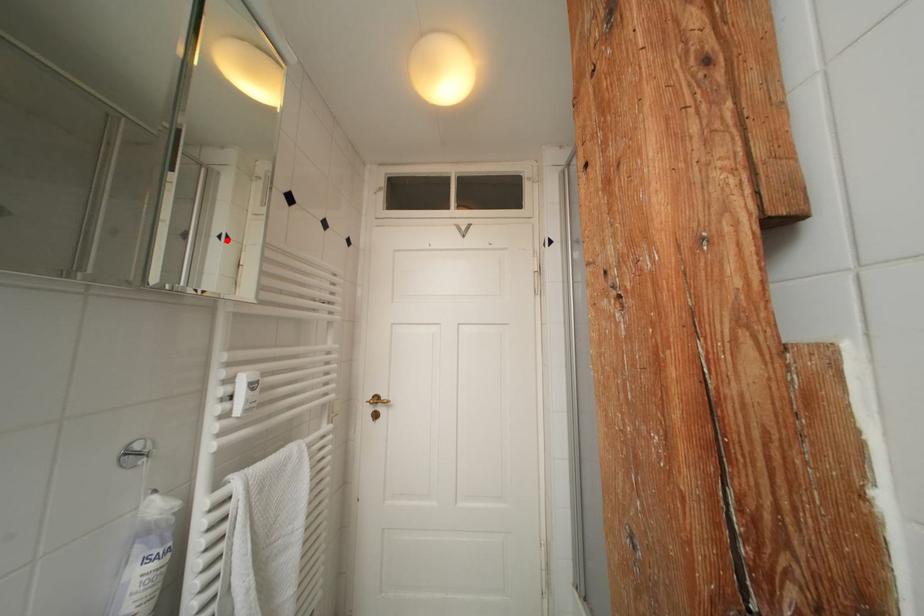
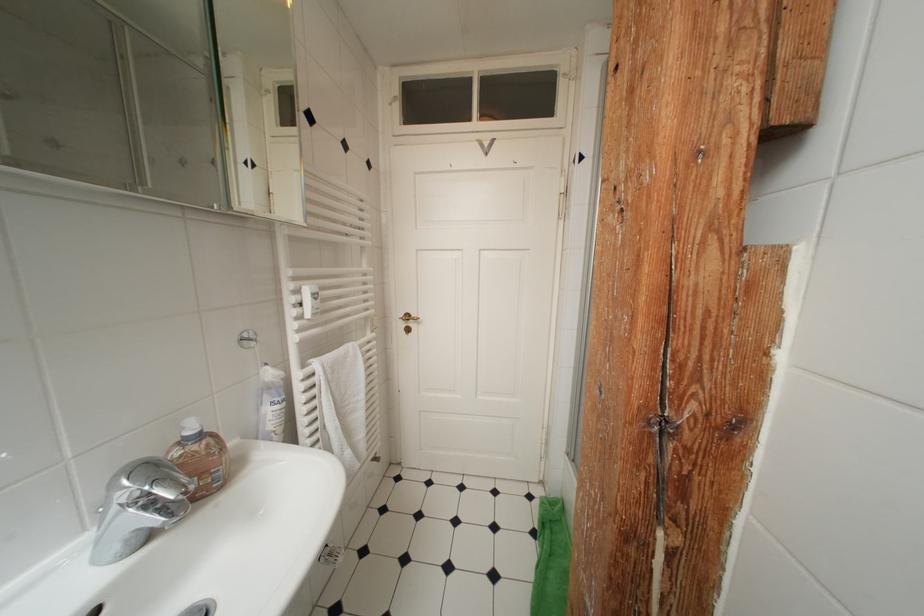
In the second image, find the point that corresponds to the highlighted location in the first image.

(253, 167)